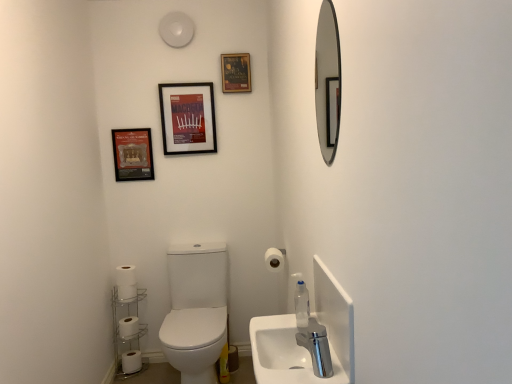
Question: From the image's perspective, is matte black frame at upper left, which appears as the 2th decorative picture when viewed from the top, located beneath matte paper poster at upper center, which appears as the second decorative picture when ordered from the bottom?

Choices:
 (A) no
 (B) yes

Answer: (B)

Question: From a real-world perspective, is matte black frame at upper left, which appears as the 2th decorative picture when viewed from the top, located beneath matte paper poster at upper center, which appears as the second decorative picture when ordered from the bottom?

Choices:
 (A) no
 (B) yes

Answer: (B)

Question: Can you confirm if matte black frame at upper left, the 2th decorative picture viewed from the right, is thinner than matte paper poster at upper center, which ranks as the 1th decorative picture in top-to-bottom order?

Choices:
 (A) no
 (B) yes

Answer: (B)

Question: Can we say matte black frame at upper left, the 2th decorative picture viewed from the right, lies outside matte paper poster at upper center, which appears as the second decorative picture when ordered from the bottom?

Choices:
 (A) yes
 (B) no

Answer: (A)

Question: From a real-world perspective, is matte black frame at upper left, which is counted as the 1th decorative picture, starting from the bottom, on matte paper poster at upper center, the 2th decorative picture when ordered from left to right?

Choices:
 (A) yes
 (B) no

Answer: (B)

Question: From the image's perspective, is white matte toilet paper at lower right, which is the 1th toilet paper from top to bottom, positioned above or below matte paper poster at upper center, which ranks as the 1th decorative picture in top-to-bottom order?

Choices:
 (A) above
 (B) below

Answer: (B)

Question: In terms of height, does white matte toilet paper at lower right, which ranks as the fourth toilet paper in back-to-front order, look taller or shorter compared to matte paper poster at upper center, which appears as the second decorative picture when ordered from the bottom?

Choices:
 (A) short
 (B) tall

Answer: (A)

Question: In terms of width, does white matte toilet paper at lower right, the 1th toilet paper in the front-to-back sequence, look wider or thinner when compared to matte paper poster at upper center, which ranks as the 1th decorative picture in top-to-bottom order?

Choices:
 (A) wide
 (B) thin

Answer: (A)

Question: Considering the positions of white matte toilet paper at lower right, acting as the fourth toilet paper starting from the left, and matte paper poster at upper center, which ranks as the 1th decorative picture in top-to-bottom order, in the image, is white matte toilet paper at lower right, acting as the fourth toilet paper starting from the left, bigger or smaller than matte paper poster at upper center, which ranks as the 1th decorative picture in top-to-bottom order,?

Choices:
 (A) small
 (B) big

Answer: (B)

Question: From the image's perspective, is white matte toilet paper at lower left, which is the 2th toilet paper in back-to-front order, located above or below matte black frame at upper left, the 2th decorative picture viewed from the right?

Choices:
 (A) above
 (B) below

Answer: (B)

Question: Is white matte toilet paper at lower left, the third toilet paper from the top, taller or shorter than matte black frame at upper left, the 2th decorative picture viewed from the right?

Choices:
 (A) tall
 (B) short

Answer: (B)

Question: Would you say white matte toilet paper at lower left, the third toilet paper from the top, is to the left or to the right of matte black frame at upper left, arranged as the 1th decorative picture when viewed from the left, in the picture?

Choices:
 (A) left
 (B) right

Answer: (A)

Question: Considering their positions, is white matte toilet paper at lower left, which is counted as the 1th toilet paper, starting from the left, located in front of or behind matte black frame at upper left, arranged as the 1th decorative picture when viewed from the left?

Choices:
 (A) behind
 (B) front

Answer: (B)

Question: From a real-world perspective, is white ceramic sink at lower right physically located above or below clear plastic soap dispenser at lower right?

Choices:
 (A) below
 (B) above

Answer: (A)

Question: Relative to clear plastic soap dispenser at lower right, is white ceramic sink at lower right in front or behind?

Choices:
 (A) front
 (B) behind

Answer: (A)